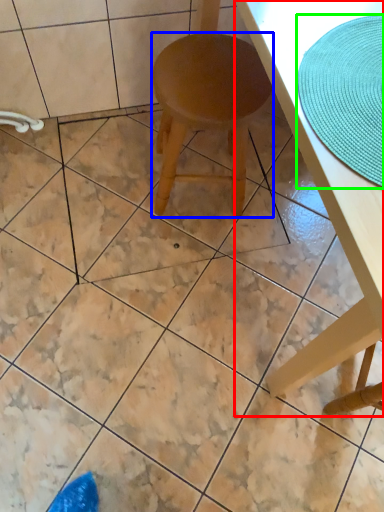
Question: Which is farther away from table (highlighted by a red box)? stool (highlighted by a blue box) or mat (highlighted by a green box)?

Choices:
 (A) stool
 (B) mat

Answer: (A)